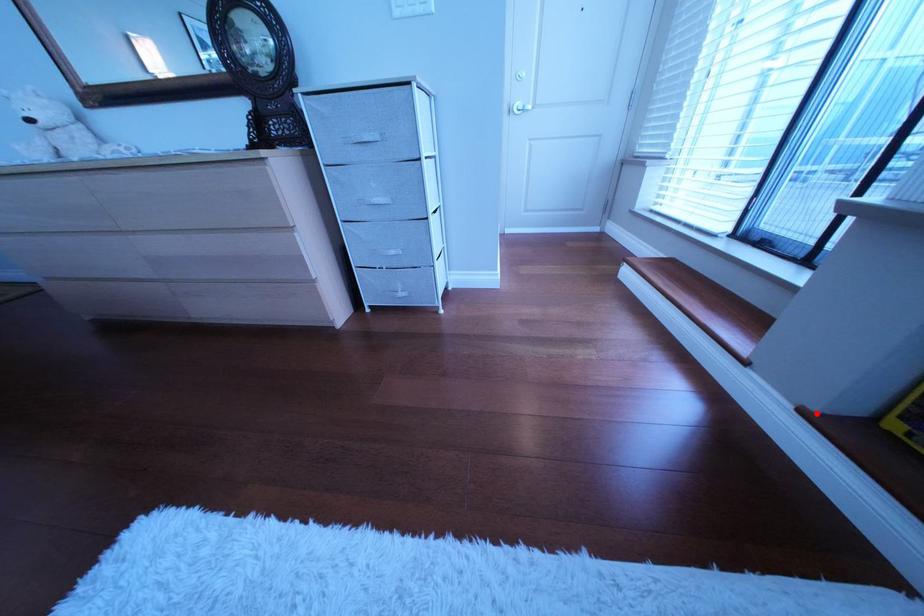
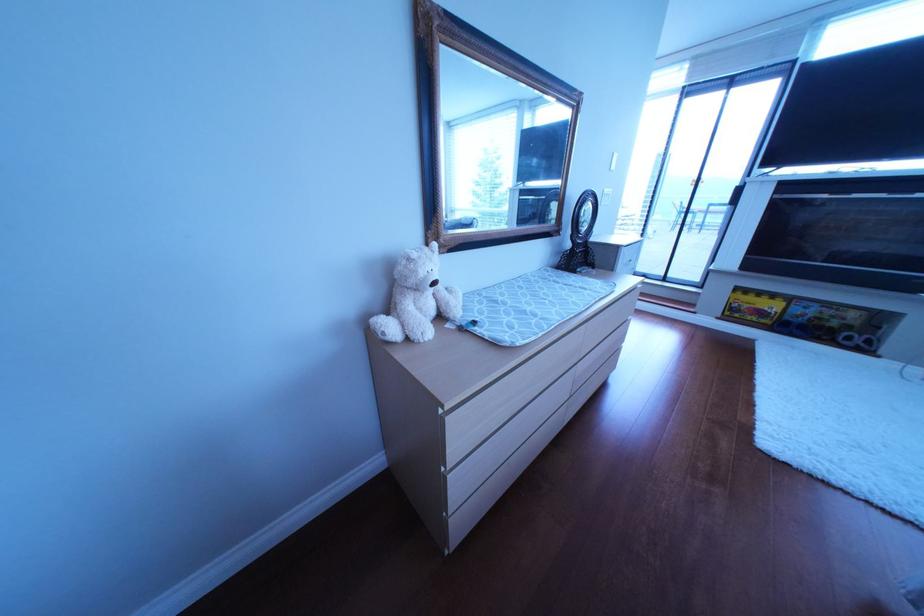
Find the pixel in the second image that matches the highlighted location in the first image.

(733, 320)